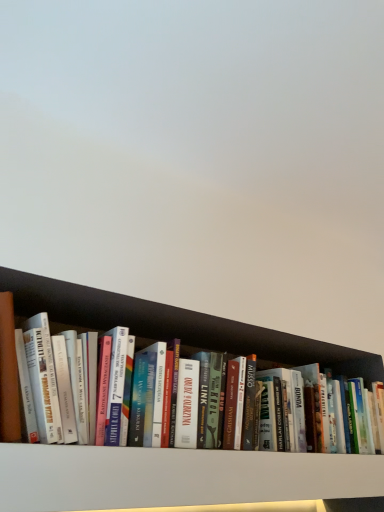
This screenshot has width=384, height=512. Describe the element at coordinates (177, 326) in the screenshot. I see `black wood shelf at lower center, acting as the 1th shelf starting from the top` at that location.

Where is `black wood shelf at lower center, which ranks as the 2th shelf in bottom-to-top order`? This screenshot has height=512, width=384. black wood shelf at lower center, which ranks as the 2th shelf in bottom-to-top order is located at coordinates (177, 326).

How much space does black wood shelf at lower center, acting as the 1th shelf starting from the top, occupy horizontally?

black wood shelf at lower center, acting as the 1th shelf starting from the top, is 5.86 inches wide.

What is the approximate height of black wood shelf at lower center, which ranks as the 2th shelf in bottom-to-top order?

The height of black wood shelf at lower center, which ranks as the 2th shelf in bottom-to-top order, is 10.43 inches.

Where is `white matte bookshelf at center, which is the second shelf in top-to-bottom order`? The width and height of the screenshot is (384, 512). white matte bookshelf at center, which is the second shelf in top-to-bottom order is located at coordinates (175, 477).

What do you see at coordinates (175, 477) in the screenshot? I see `white matte bookshelf at center, which is the second shelf in top-to-bottom order` at bounding box center [175, 477].

Identify the location of black wood shelf at lower center, acting as the 1th shelf starting from the top. (177, 326).

Is black wood shelf at lower center, which ranks as the 2th shelf in bottom-to-top order, to the left of white matte bookshelf at center, which is the second shelf in top-to-bottom order, from the viewer's perspective?

No.

Between black wood shelf at lower center, which ranks as the 2th shelf in bottom-to-top order, and white matte bookshelf at center, the first shelf when ordered from bottom to top, which one is positioned in front?

white matte bookshelf at center, the first shelf when ordered from bottom to top, is in front.

Which is farther from the camera, (56, 290) or (242, 466)?

The point (242, 466) is more distant.

From the image's perspective, who appears lower, black wood shelf at lower center, acting as the 1th shelf starting from the top, or white matte bookshelf at center, which is the second shelf in top-to-bottom order?

white matte bookshelf at center, which is the second shelf in top-to-bottom order, from the image's perspective.

From a real-world perspective, which object rests below the other?

white matte bookshelf at center, which is the second shelf in top-to-bottom order, from a real-world perspective.

Based on the photo, between black wood shelf at lower center, which ranks as the 2th shelf in bottom-to-top order, and white matte bookshelf at center, the first shelf when ordered from bottom to top, which one has smaller width?

black wood shelf at lower center, which ranks as the 2th shelf in bottom-to-top order.

Considering the sizes of black wood shelf at lower center, which ranks as the 2th shelf in bottom-to-top order, and white matte bookshelf at center, which is the second shelf in top-to-bottom order, in the image, is black wood shelf at lower center, which ranks as the 2th shelf in bottom-to-top order, taller or shorter than white matte bookshelf at center, which is the second shelf in top-to-bottom order,?

black wood shelf at lower center, which ranks as the 2th shelf in bottom-to-top order, is taller than white matte bookshelf at center, which is the second shelf in top-to-bottom order.

Does black wood shelf at lower center, which ranks as the 2th shelf in bottom-to-top order, have a larger size compared to white matte bookshelf at center, the first shelf when ordered from bottom to top?

Indeed, black wood shelf at lower center, which ranks as the 2th shelf in bottom-to-top order, has a larger size compared to white matte bookshelf at center, the first shelf when ordered from bottom to top.

Is black wood shelf at lower center, acting as the 1th shelf starting from the top, outside of white matte bookshelf at center, the first shelf when ordered from bottom to top?

Yes, black wood shelf at lower center, acting as the 1th shelf starting from the top, is located beyond the bounds of white matte bookshelf at center, the first shelf when ordered from bottom to top.

Is black wood shelf at lower center, acting as the 1th shelf starting from the top, not near white matte bookshelf at center, which is the second shelf in top-to-bottom order?

No, there isn't a large distance between black wood shelf at lower center, acting as the 1th shelf starting from the top, and white matte bookshelf at center, which is the second shelf in top-to-bottom order.

Does black wood shelf at lower center, acting as the 1th shelf starting from the top, turn towards white matte bookshelf at center, the first shelf when ordered from bottom to top?

No, black wood shelf at lower center, acting as the 1th shelf starting from the top, is not facing towards white matte bookshelf at center, the first shelf when ordered from bottom to top.

How different are the orientations of black wood shelf at lower center, which ranks as the 2th shelf in bottom-to-top order, and white matte bookshelf at center, which is the second shelf in top-to-bottom order, in degrees?

The angular difference between black wood shelf at lower center, which ranks as the 2th shelf in bottom-to-top order, and white matte bookshelf at center, which is the second shelf in top-to-bottom order, is 0.000457 degrees.

The image size is (384, 512). Identify the location of shelf on the right of white matte bookshelf at center, the first shelf when ordered from bottom to top. (177, 326).

Which object is positioned more to the right, white matte bookshelf at center, which is the second shelf in top-to-bottom order, or black wood shelf at lower center, which ranks as the 2th shelf in bottom-to-top order?

black wood shelf at lower center, which ranks as the 2th shelf in bottom-to-top order.

Considering the relative positions of white matte bookshelf at center, the first shelf when ordered from bottom to top, and black wood shelf at lower center, acting as the 1th shelf starting from the top, in the image provided, is white matte bookshelf at center, the first shelf when ordered from bottom to top, behind black wood shelf at lower center, acting as the 1th shelf starting from the top,?

No, the depth of white matte bookshelf at center, the first shelf when ordered from bottom to top, is less than that of black wood shelf at lower center, acting as the 1th shelf starting from the top.

Is point (66, 455) positioned in front of point (77, 328)?

Yes, point (66, 455) is closer to viewer.

From the image's perspective, is white matte bookshelf at center, which is the second shelf in top-to-bottom order, above or below black wood shelf at lower center, acting as the 1th shelf starting from the top?

Based on their image positions, white matte bookshelf at center, which is the second shelf in top-to-bottom order, is located beneath black wood shelf at lower center, acting as the 1th shelf starting from the top.

From a real-world perspective, is white matte bookshelf at center, which is the second shelf in top-to-bottom order, positioned under black wood shelf at lower center, which ranks as the 2th shelf in bottom-to-top order, based on gravity?

Yes, from a real-world perspective, white matte bookshelf at center, which is the second shelf in top-to-bottom order, is below black wood shelf at lower center, which ranks as the 2th shelf in bottom-to-top order.

Is white matte bookshelf at center, which is the second shelf in top-to-bottom order, wider or thinner than black wood shelf at lower center, acting as the 1th shelf starting from the top?

Considering their sizes, white matte bookshelf at center, which is the second shelf in top-to-bottom order, looks broader than black wood shelf at lower center, acting as the 1th shelf starting from the top.

From the picture: Who is shorter, white matte bookshelf at center, the first shelf when ordered from bottom to top, or black wood shelf at lower center, which ranks as the 2th shelf in bottom-to-top order?

white matte bookshelf at center, the first shelf when ordered from bottom to top, is shorter.

Can you confirm if white matte bookshelf at center, the first shelf when ordered from bottom to top, is smaller than black wood shelf at lower center, which ranks as the 2th shelf in bottom-to-top order?

Indeed, white matte bookshelf at center, the first shelf when ordered from bottom to top, has a smaller size compared to black wood shelf at lower center, which ranks as the 2th shelf in bottom-to-top order.

Would you say black wood shelf at lower center, acting as the 1th shelf starting from the top, is part of white matte bookshelf at center, the first shelf when ordered from bottom to top,'s contents?

Actually, black wood shelf at lower center, acting as the 1th shelf starting from the top, is outside white matte bookshelf at center, the first shelf when ordered from bottom to top.

Would you consider white matte bookshelf at center, the first shelf when ordered from bottom to top, to be distant from black wood shelf at lower center, which ranks as the 2th shelf in bottom-to-top order?

No, white matte bookshelf at center, the first shelf when ordered from bottom to top, is in close proximity to black wood shelf at lower center, which ranks as the 2th shelf in bottom-to-top order.

Looking at this image, is white matte bookshelf at center, the first shelf when ordered from bottom to top, turned away from black wood shelf at lower center, acting as the 1th shelf starting from the top?

No, black wood shelf at lower center, acting as the 1th shelf starting from the top, is not at the back of white matte bookshelf at center, the first shelf when ordered from bottom to top.

What's the angular difference between white matte bookshelf at center, the first shelf when ordered from bottom to top, and black wood shelf at lower center, acting as the 1th shelf starting from the top,'s facing directions?

white matte bookshelf at center, the first shelf when ordered from bottom to top, and black wood shelf at lower center, acting as the 1th shelf starting from the top, are facing 0.000457 degrees away from each other.

Where is `shelf below the black wood shelf at lower center, acting as the 1th shelf starting from the top (from the image's perspective)`? Image resolution: width=384 pixels, height=512 pixels. shelf below the black wood shelf at lower center, acting as the 1th shelf starting from the top (from the image's perspective) is located at coordinates (175, 477).

The height and width of the screenshot is (512, 384). What are the coordinates of `shelf behind the white matte bookshelf at center, the first shelf when ordered from bottom to top` in the screenshot? It's located at (177, 326).

Locate an element on the screen. The image size is (384, 512). shelf located on the right of white matte bookshelf at center, the first shelf when ordered from bottom to top is located at coordinates (177, 326).